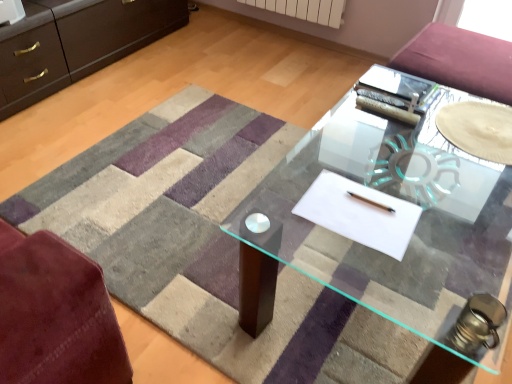
Locate an element on the screen. empty space that is ontop of white paper at center (from a real-world perspective) is located at coordinates (356, 208).